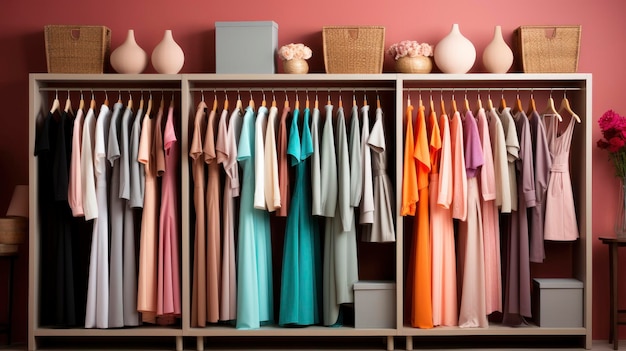
This screenshot has width=626, height=351. Find the location of `vases`. vases is located at coordinates (124, 45), (168, 50), (458, 47), (494, 48).